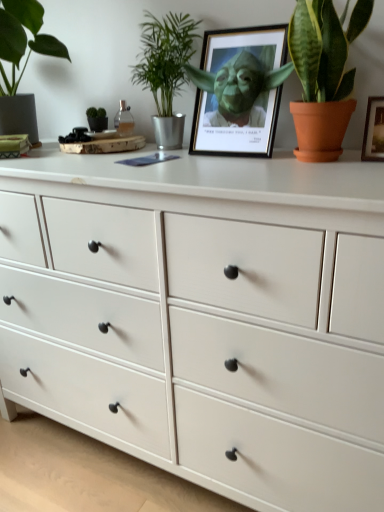
The width and height of the screenshot is (384, 512). I want to click on free space in front of green leafy plant at upper center, acting as the 2th houseplant starting from the left, so click(x=155, y=158).